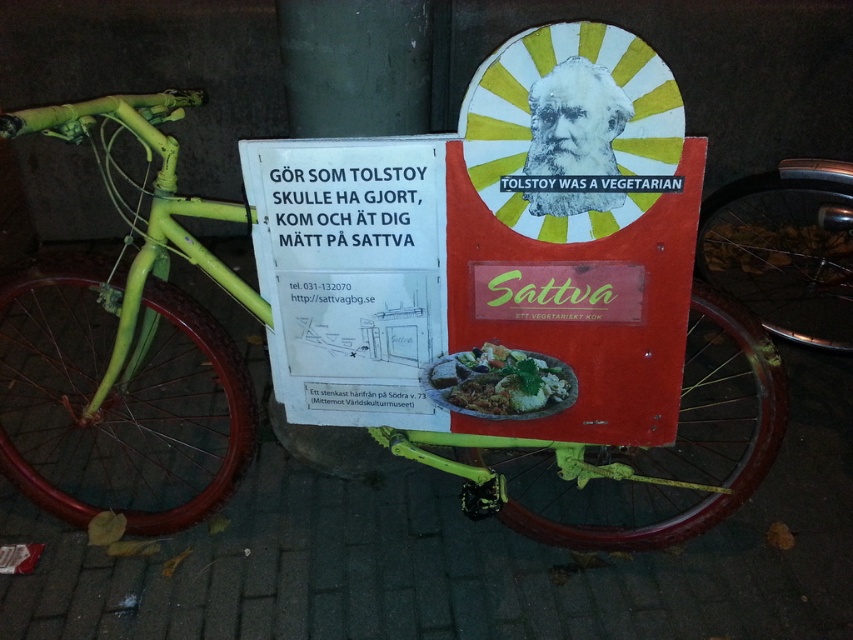
You are planning to take a photo of the green matte bicycle at left and the matte brown plate at center. Which object should you focus on first if you want to ensure both are in the frame without moving the camera?

The green matte bicycle at left is larger in size than the matte brown plate at center, so you should focus on the larger object first to ensure both fit in the frame.